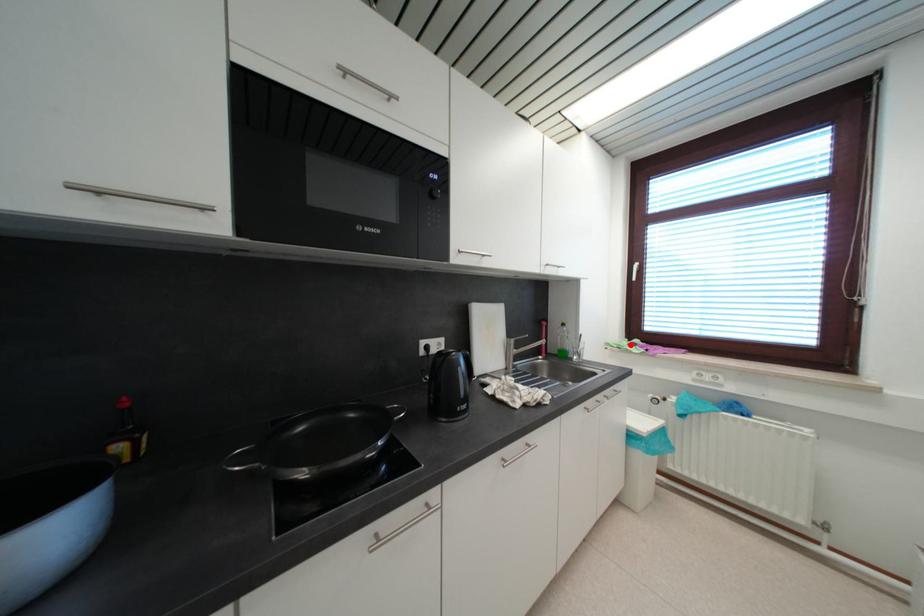
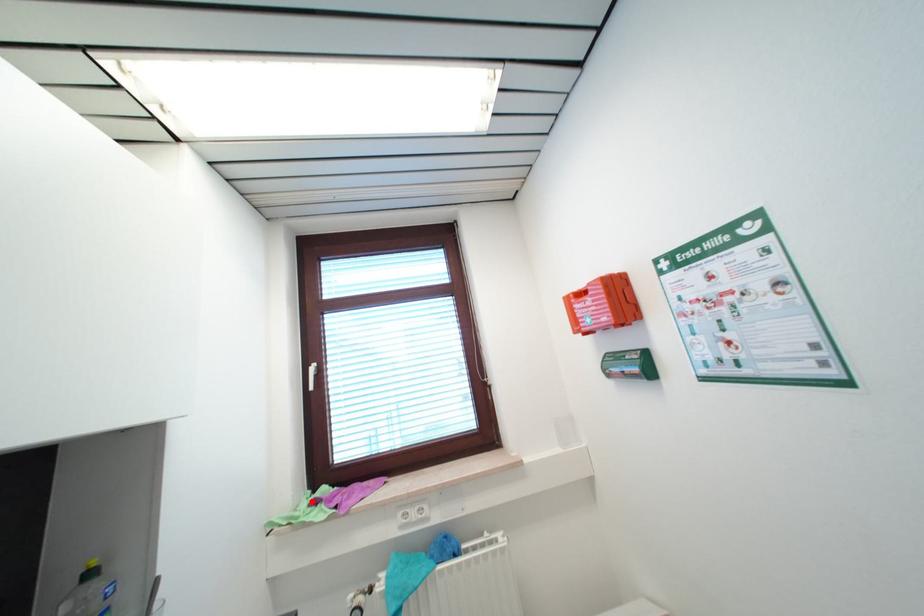
I am providing you with two images of the same scene from different viewpoints. A red point is marked on the first image and another point is marked on the second image. Is the marked point in image1 the same physical position as the marked point in image2?

Yes